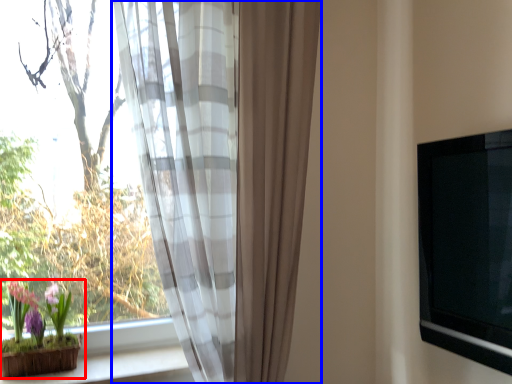
Question: Which of the following is the closest to the observer, houseplant (highlighted by a red box) or curtain (highlighted by a blue box)?

Choices:
 (A) houseplant
 (B) curtain

Answer: (B)